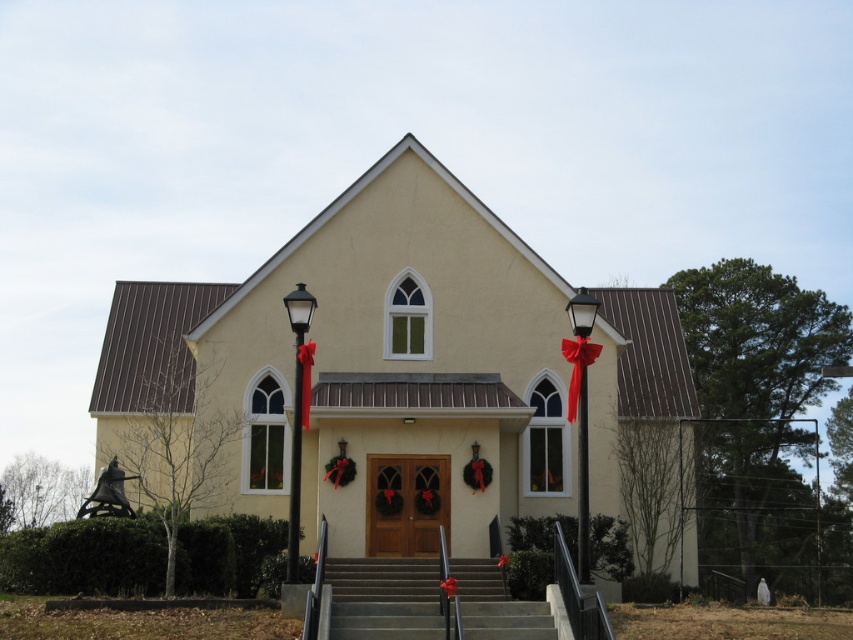
Is yellow matte church at center smaller than smooth concrete stairs at center?

Actually, yellow matte church at center might be larger than smooth concrete stairs at center.

Measure the distance between yellow matte church at center and smooth concrete stairs at center.

yellow matte church at center is 42.06 feet away from smooth concrete stairs at center.

Is point (114, 394) positioned behind point (416, 588)?

Yes, point (114, 394) is farther from viewer.

The height and width of the screenshot is (640, 853). Identify the location of yellow matte church at center. (403, 381).